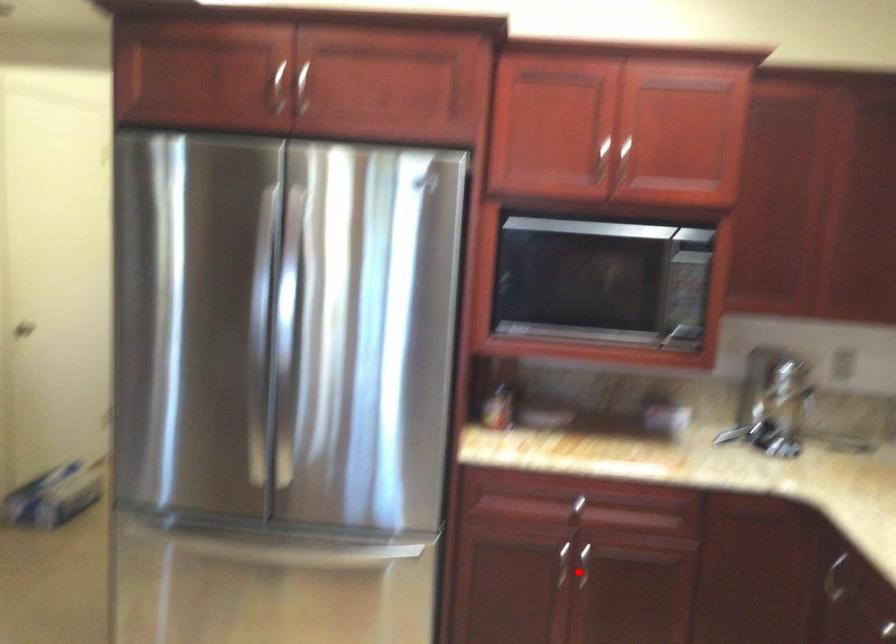
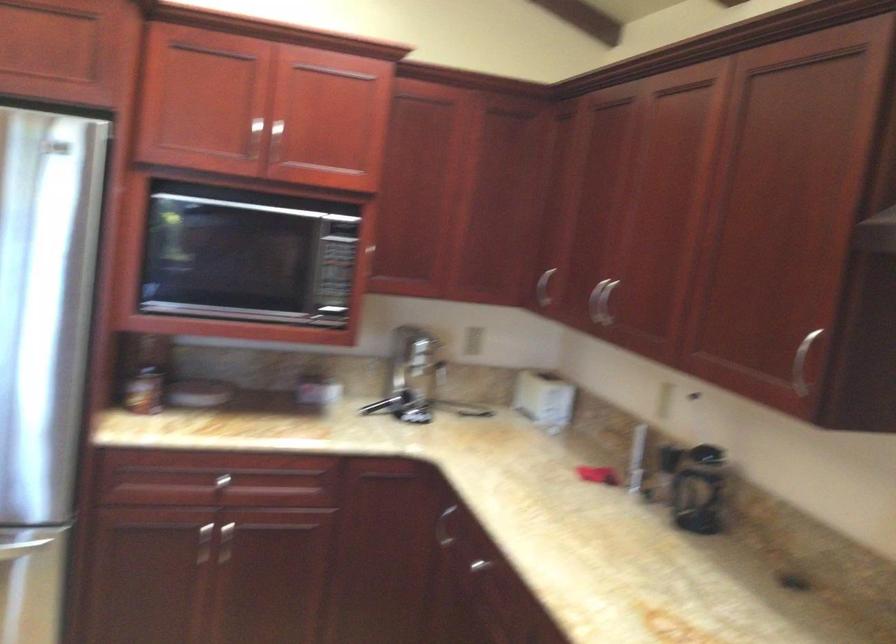
Where in the second image is the point corresponding to the highlighted location from the first image?

(222, 543)